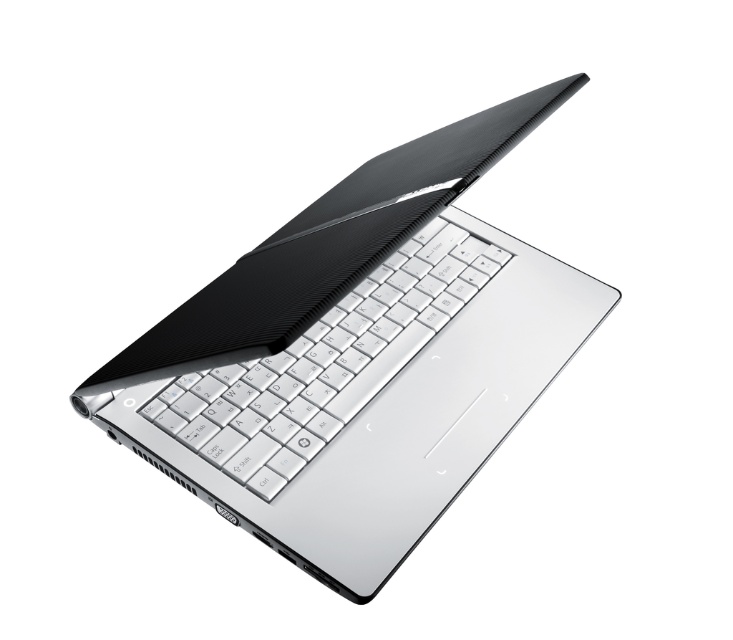
Consider the image. Does silver metallic laptop at center have a smaller size compared to white matte keyboard at center?

No, silver metallic laptop at center is not smaller than white matte keyboard at center.

Does silver metallic laptop at center have a lesser width compared to white matte keyboard at center?

Incorrect, silver metallic laptop at center's width is not less than white matte keyboard at center's.

The height and width of the screenshot is (640, 733). Describe the element at coordinates (357, 356) in the screenshot. I see `silver metallic laptop at center` at that location.

In order to click on silver metallic laptop at center in this screenshot , I will do click(x=357, y=356).